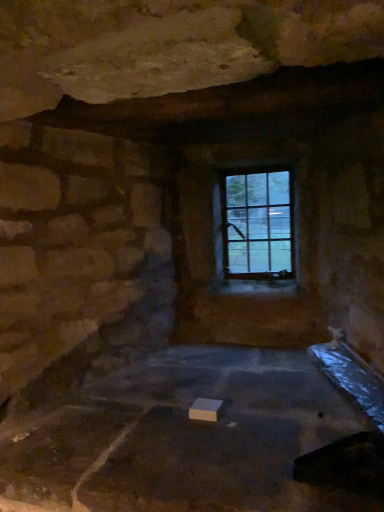
Question: Is point click(x=173, y=440) positioned closer to the camera than point click(x=261, y=211)?

Choices:
 (A) farther
 (B) closer

Answer: (B)

Question: From the image's perspective, is white matte block at center located above or below clear glass window at upper center?

Choices:
 (A) below
 (B) above

Answer: (A)

Question: Looking at the image, does white matte block at center seem bigger or smaller compared to clear glass window at upper center?

Choices:
 (A) small
 (B) big

Answer: (B)

Question: Is clear glass window at upper center inside or outside of white matte block at center?

Choices:
 (A) inside
 (B) outside

Answer: (B)

Question: From the image's perspective, is clear glass window at upper center located above or below white matte block at center?

Choices:
 (A) above
 (B) below

Answer: (A)

Question: Does point (213, 201) appear closer or farther from the camera than point (294, 422)?

Choices:
 (A) closer
 (B) farther

Answer: (B)

Question: In terms of width, does clear glass window at upper center look wider or thinner when compared to white matte block at center?

Choices:
 (A) thin
 (B) wide

Answer: (A)